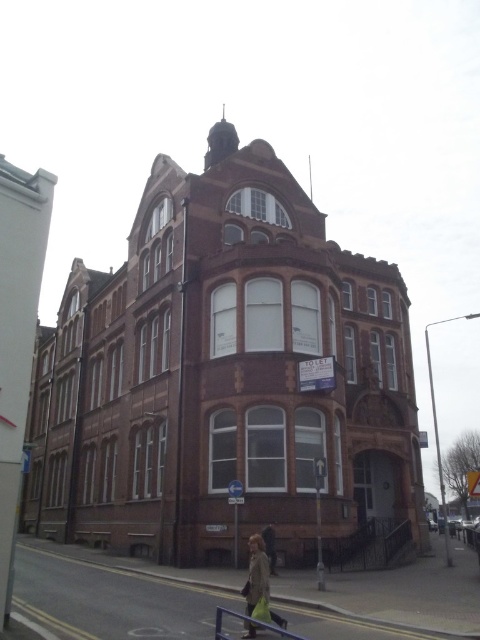
Question: Which point is closer to the camera?

Choices:
 (A) metallic gray railing at lower center
 (B) light brown leather coat at lower center

Answer: (A)

Question: Does light brown leather coat at lower center appear on the left side of metallic gray railing at lower center?

Choices:
 (A) yes
 (B) no

Answer: (A)

Question: Which object appears farthest from the camera in this image?

Choices:
 (A) light brown leather coat at lower center
 (B) metallic gray railing at lower center

Answer: (A)

Question: Can you confirm if light brown leather coat at lower center is positioned above metallic gray railing at lower center?

Choices:
 (A) yes
 (B) no

Answer: (A)

Question: Does light brown leather coat at lower center have a lesser width compared to metallic gray railing at lower center?

Choices:
 (A) no
 (B) yes

Answer: (B)